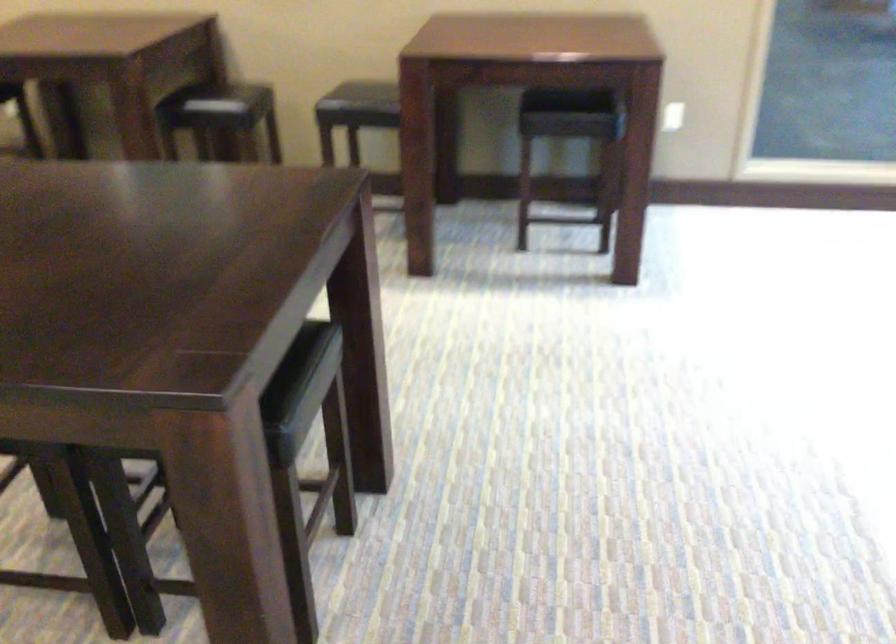
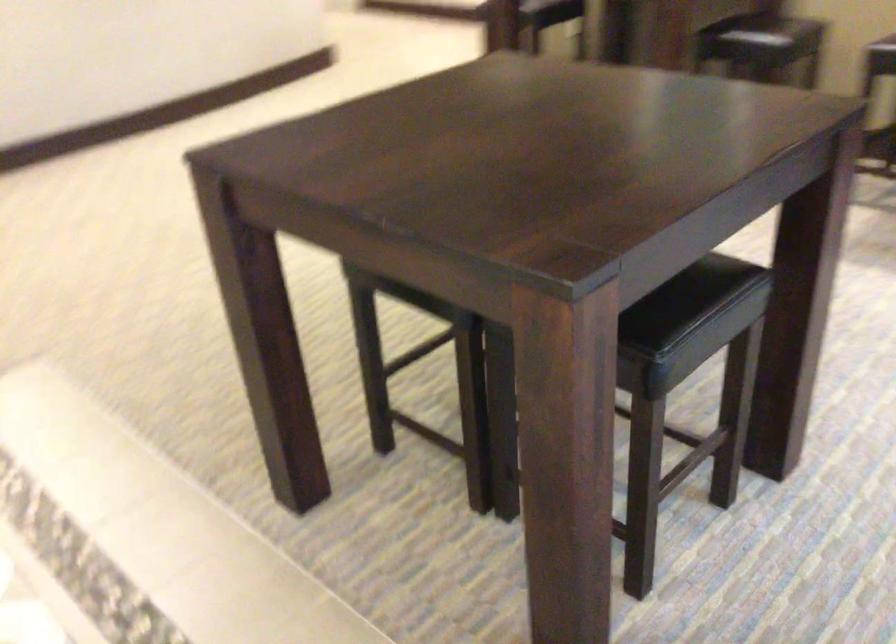
Question: The camera is either moving clockwise (left) or counter-clockwise (right) around the object. The first image is from the beginning of the video and the second image is from the end. Is the camera moving left or right when shooting the video?

Choices:
 (A) Left
 (B) Right

Answer: (B)